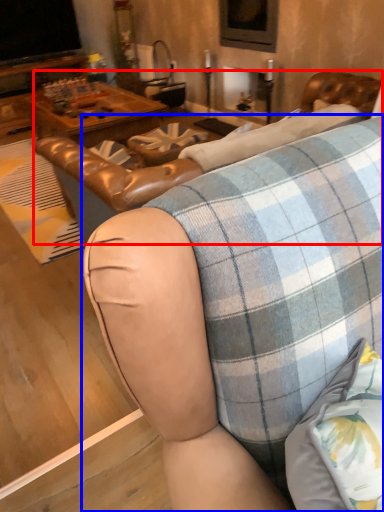
Question: Which of the following is the farthest to the observer, swivel chair (highlighted by a red box) or studio couch (highlighted by a blue box)?

Choices:
 (A) swivel chair
 (B) studio couch

Answer: (B)